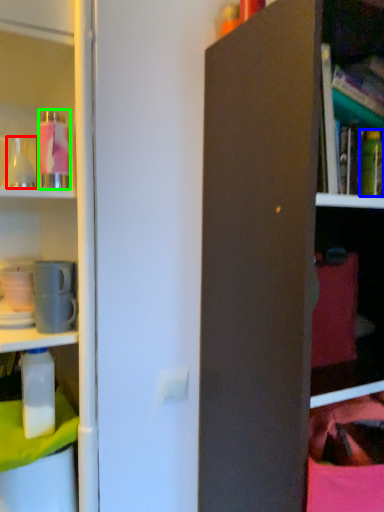
Question: Which is nearer to the bottle (highlighted by a red box)? bottle (highlighted by a blue box) or bottle (highlighted by a green box).

Choices:
 (A) bottle
 (B) bottle

Answer: (B)